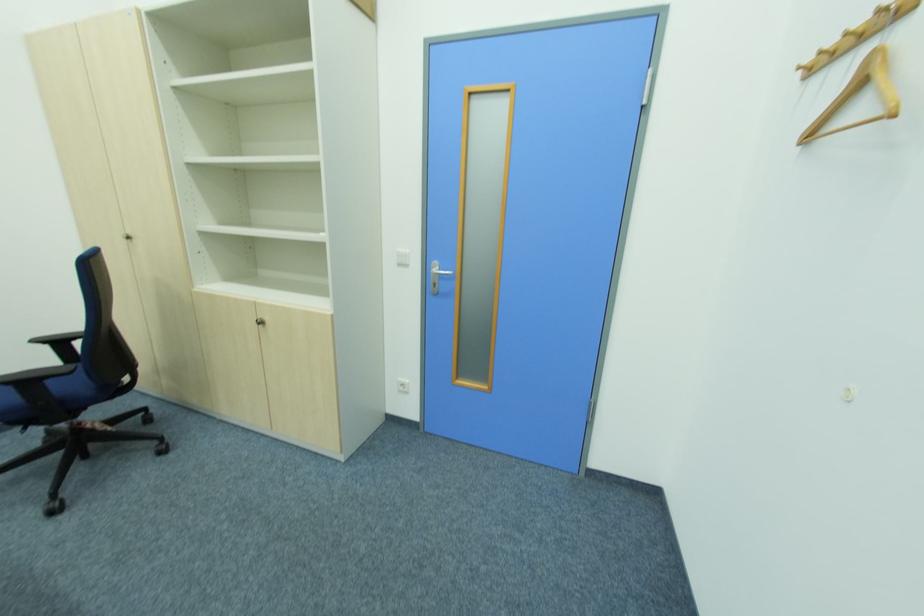
What do you see at coordinates (858, 95) in the screenshot?
I see `the wooden coat peg` at bounding box center [858, 95].